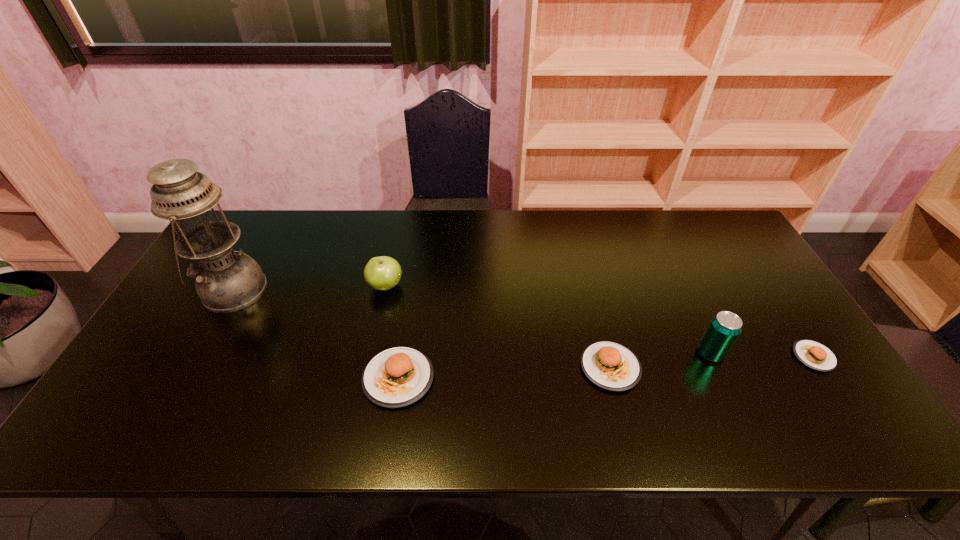
Find the location of a particular element. the leftmost food is located at coordinates (396, 377).

The image size is (960, 540). I want to click on the second shortest food, so click(x=610, y=365).

Find the location of a particular element. This screenshot has width=960, height=540. the second food from left to right is located at coordinates (610, 365).

Where is `the shortest object`? the shortest object is located at coordinates click(814, 355).

Find the location of `the rightmost food`. the rightmost food is located at coordinates (814, 355).

Where is `oil lamp`? Image resolution: width=960 pixels, height=540 pixels. oil lamp is located at coordinates (226, 281).

In order to click on the leftmost object in this screenshot , I will do `click(226, 281)`.

The width and height of the screenshot is (960, 540). I want to click on beer can, so click(x=725, y=327).

Where is `apple`? Image resolution: width=960 pixels, height=540 pixels. apple is located at coordinates (382, 273).

What are the coordinates of `free space located 0.390m on the back of the leftmost food` in the screenshot? It's located at (418, 252).